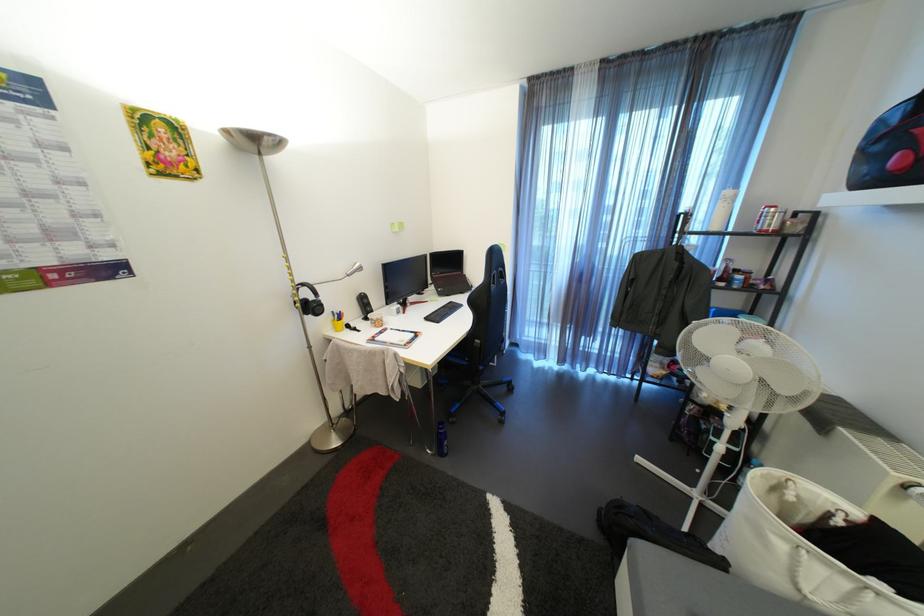
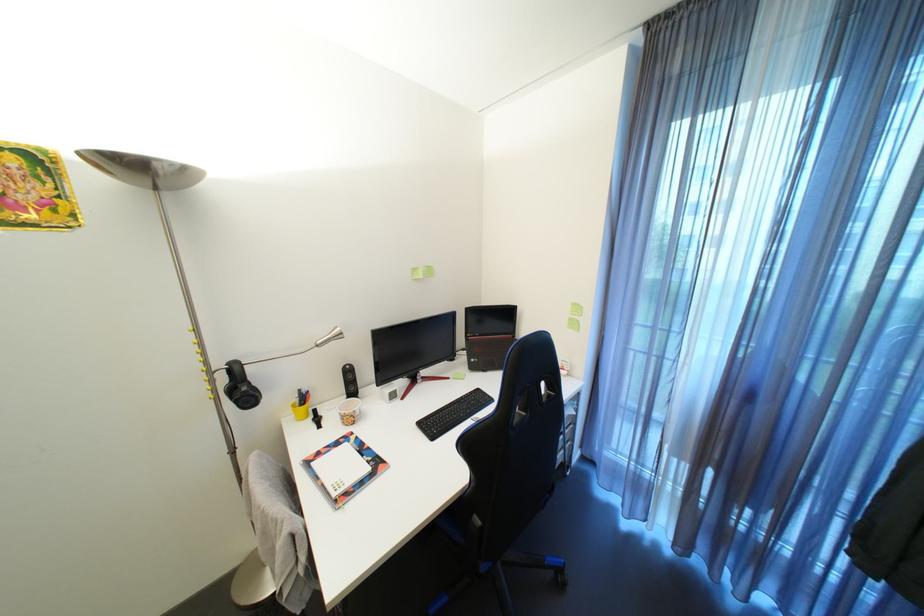
Question: The camera is either moving clockwise (left) or counter-clockwise (right) around the object. The first image is from the beginning of the video and the second image is from the end. Is the camera moving left or right when shooting the video?

Choices:
 (A) Left
 (B) Right

Answer: (B)